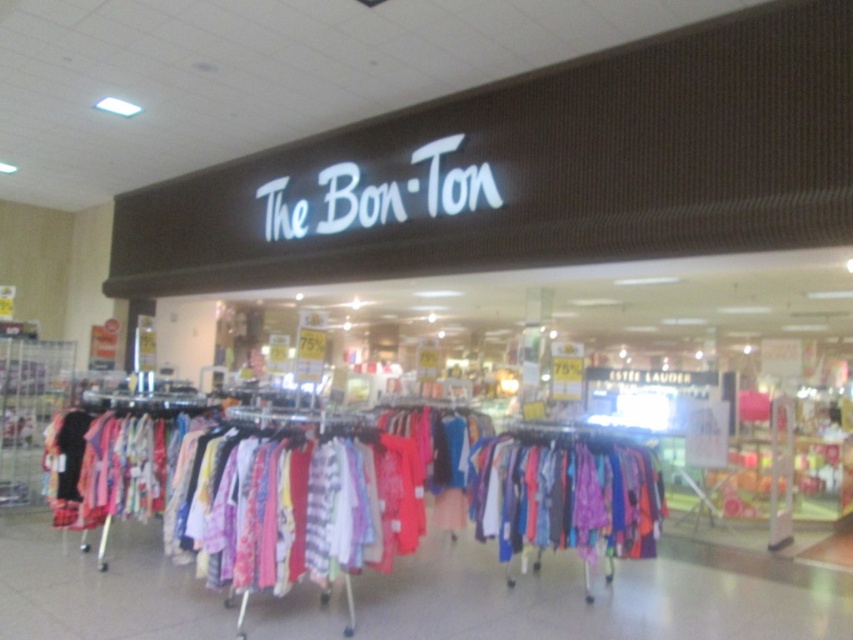
You are a customer in The Bon Ton store looking to buy a dress. You see both the brightly colored fabric at center and the multicolored fabric dress at center. Which item is taller?

The brightly colored fabric at center is much taller than the multicolored fabric dress at center.